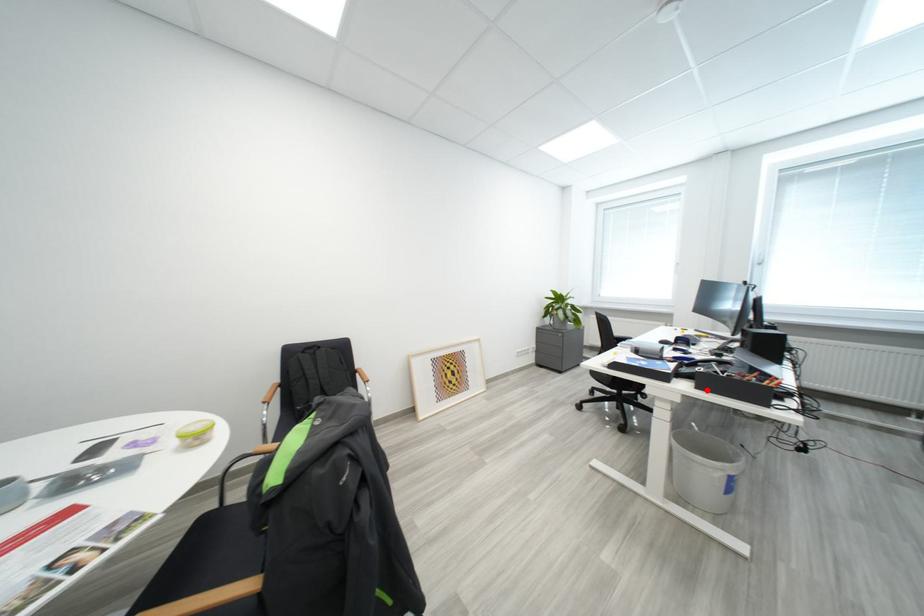
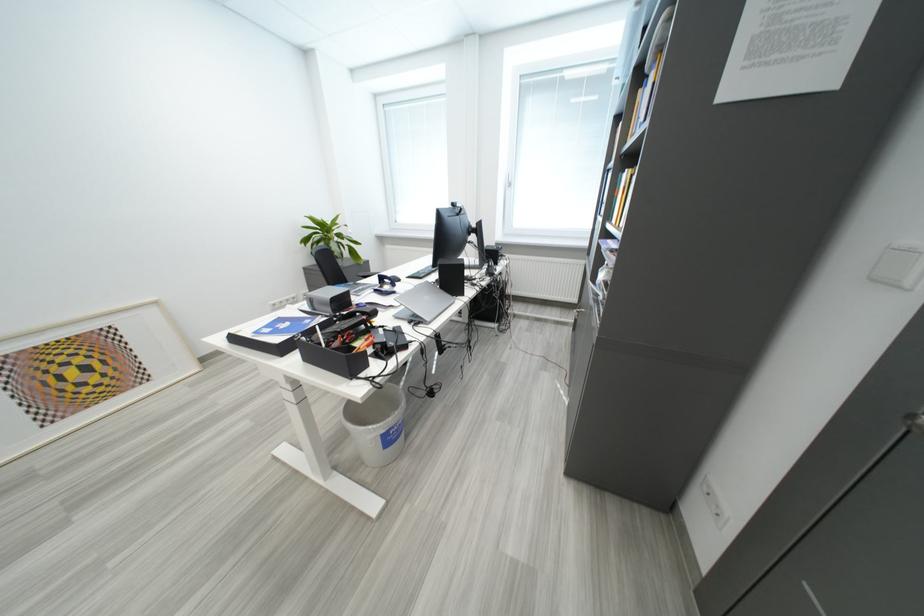
Question: I am providing you with two images of the same scene from different viewpoints. Given a red point in image1, look at the same physical point in image2. Is it:

Choices:
 (A) Closer to the viewpoint
 (B) Farther from the viewpoint

Answer: (B)